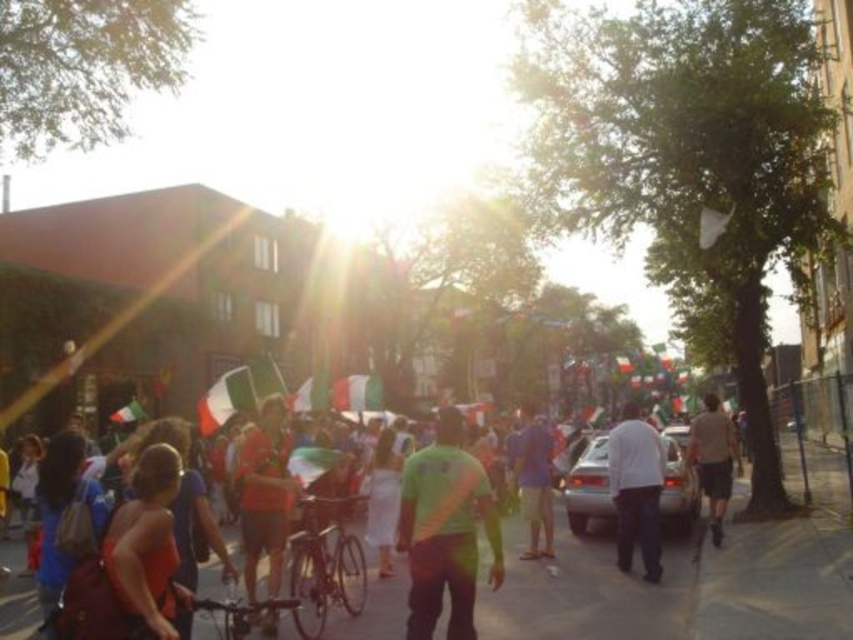
Question: Where is gray concrete sidewalk at center located in relation to matte red shirt at center in the image?

Choices:
 (A) right
 (B) left

Answer: (A)

Question: Which point is farther to the camera?

Choices:
 (A) green matte shirt at center
 (B) matte red dress at lower left

Answer: (A)

Question: Which point is farther from the camera taking this photo?

Choices:
 (A) (538, 544)
 (B) (149, 605)
 (C) (416, 618)

Answer: (A)

Question: Can you confirm if gray concrete sidewalk at center is thinner than blue cotton shirt at center?

Choices:
 (A) yes
 (B) no

Answer: (B)

Question: Does matte red dress at lower left appear on the left side of white matte shirt at center?

Choices:
 (A) no
 (B) yes

Answer: (B)

Question: Which point is farther from the camera taking this photo?

Choices:
 (A) (660, 452)
 (B) (718, 513)

Answer: (B)